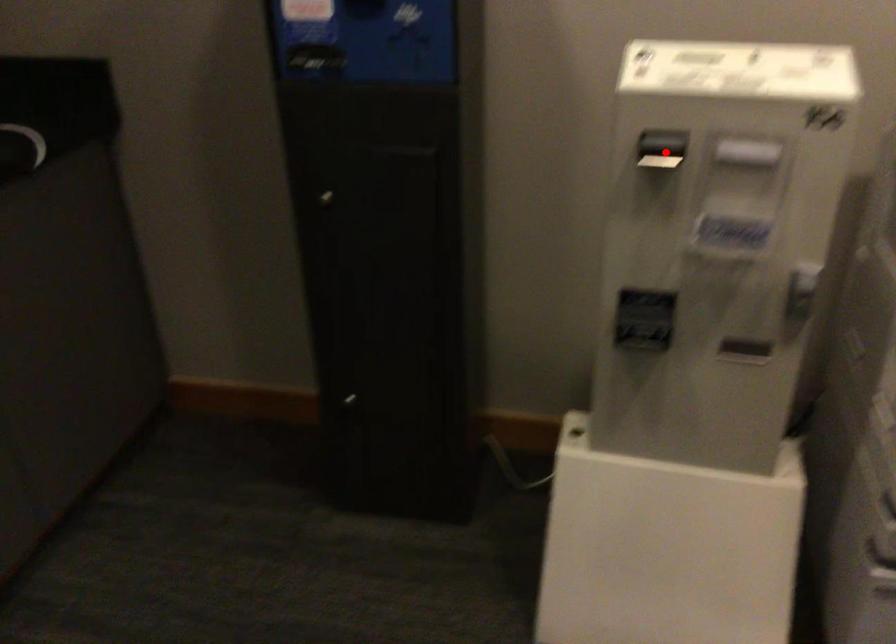
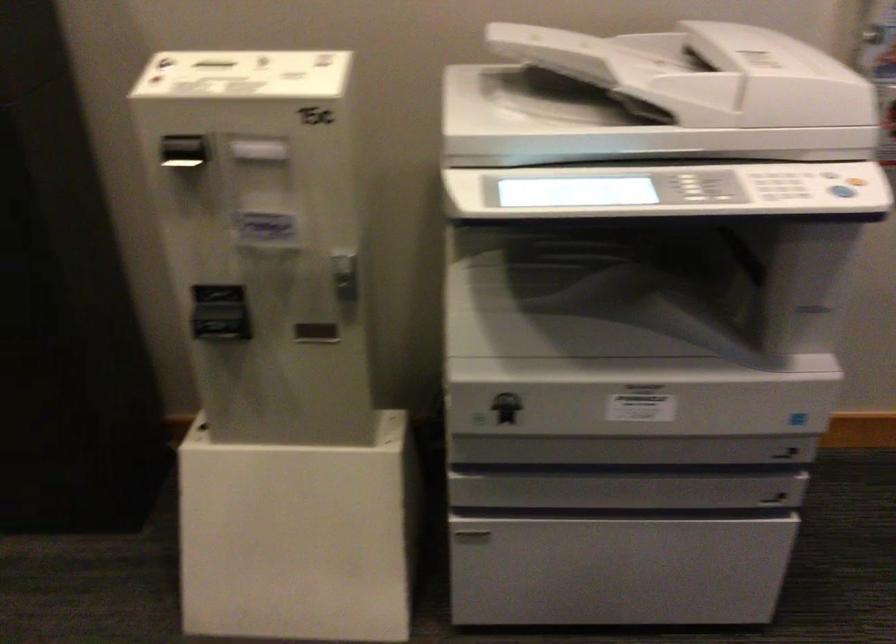
Question: I am providing you with two images of the same scene from different viewpoints. A red point is marked on the first image. Is the red point's position out of view in image 2?

Choices:
 (A) Yes
 (B) No

Answer: (B)